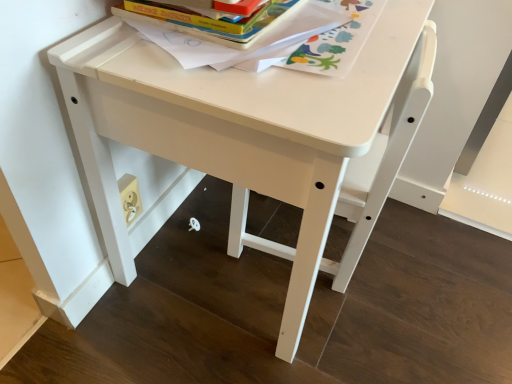
Question: Is the position of hardcover book at upper center more distant than that of white plastic chair at center?

Choices:
 (A) yes
 (B) no

Answer: (B)

Question: Is hardcover book at upper center closer to camera compared to white plastic chair at center?

Choices:
 (A) yes
 (B) no

Answer: (A)

Question: From the image's perspective, is hardcover book at upper center below white plastic chair at center?

Choices:
 (A) yes
 (B) no

Answer: (B)

Question: Is hardcover book at upper center thinner than white plastic chair at center?

Choices:
 (A) yes
 (B) no

Answer: (B)

Question: Is hardcover book at upper center smaller than white plastic chair at center?

Choices:
 (A) yes
 (B) no

Answer: (A)

Question: From a real-world perspective, is hardcover book at upper center positioned above or below hardcover book at upper center?

Choices:
 (A) above
 (B) below

Answer: (B)

Question: Is hardcover book at upper center bigger or smaller than hardcover book at upper center?

Choices:
 (A) big
 (B) small

Answer: (A)

Question: Is hardcover book at upper center inside the boundaries of hardcover book at upper center, or outside?

Choices:
 (A) outside
 (B) inside

Answer: (A)

Question: Considering their positions, is hardcover book at upper center located in front of or behind hardcover book at upper center?

Choices:
 (A) front
 (B) behind

Answer: (A)

Question: In terms of height, does white plastic chair at center look taller or shorter compared to hardcover book at upper center?

Choices:
 (A) tall
 (B) short

Answer: (A)

Question: Is white plastic chair at center spatially inside hardcover book at upper center, or outside of it?

Choices:
 (A) outside
 (B) inside

Answer: (A)

Question: Considering the relative positions of white plastic chair at center and hardcover book at upper center in the image provided, is white plastic chair at center to the left or to the right of hardcover book at upper center?

Choices:
 (A) left
 (B) right

Answer: (B)

Question: From the image's perspective, is white plastic chair at center above or below hardcover book at upper center?

Choices:
 (A) above
 (B) below

Answer: (B)

Question: Is white plastic chair at center situated inside white matte table at center or outside?

Choices:
 (A) inside
 (B) outside

Answer: (A)

Question: Based on their positions, is white plastic chair at center located to the left or right of white matte table at center?

Choices:
 (A) left
 (B) right

Answer: (B)